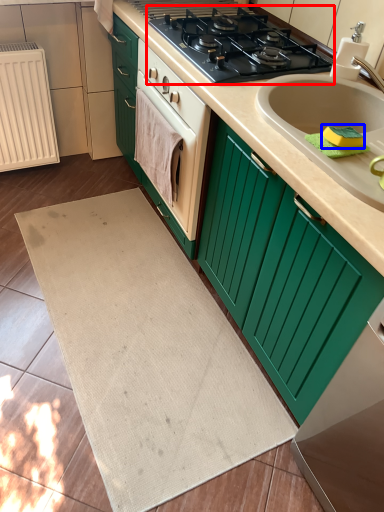
Question: Which object is further to the camera taking this photo, gas stove (highlighted by a red box) or soap (highlighted by a blue box)?

Choices:
 (A) gas stove
 (B) soap

Answer: (A)